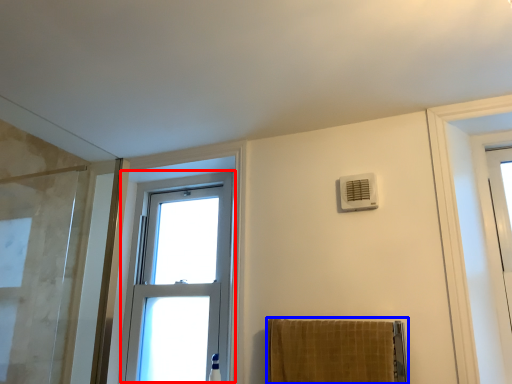
Question: Which object is further to the camera taking this photo, window (highlighted by a red box) or towel (highlighted by a blue box)?

Choices:
 (A) window
 (B) towel

Answer: (A)